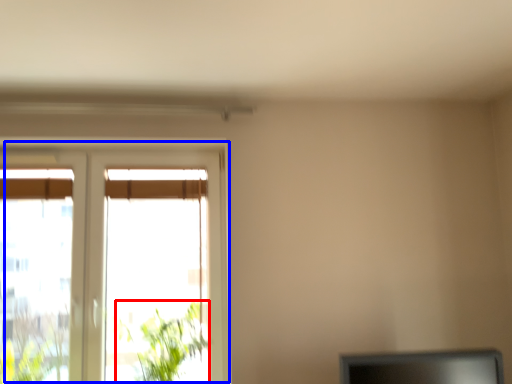
Question: Among these objects, which one is farthest to the camera, plant (highlighted by a red box) or window (highlighted by a blue box)?

Choices:
 (A) plant
 (B) window

Answer: (B)